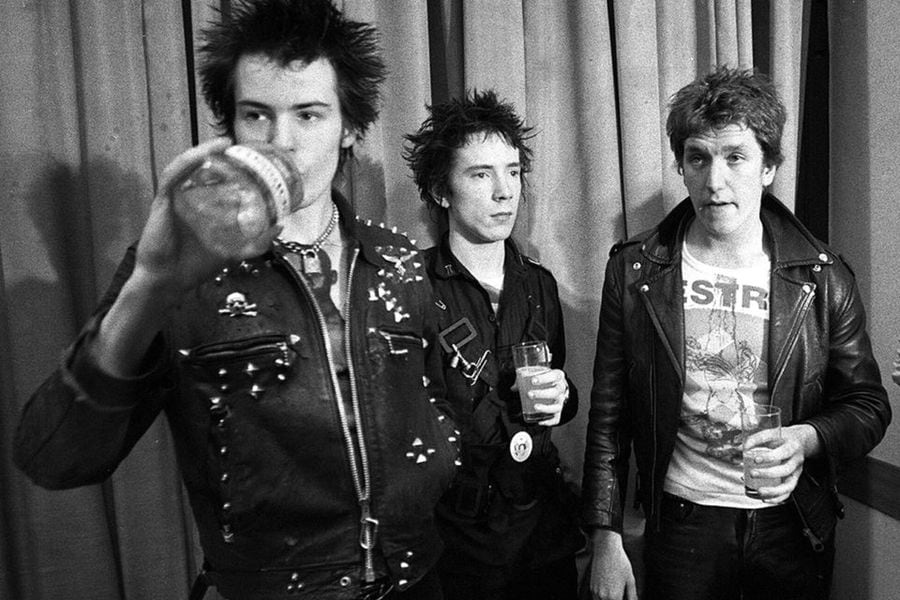
This screenshot has height=600, width=900. I want to click on wall, so click(870, 138).